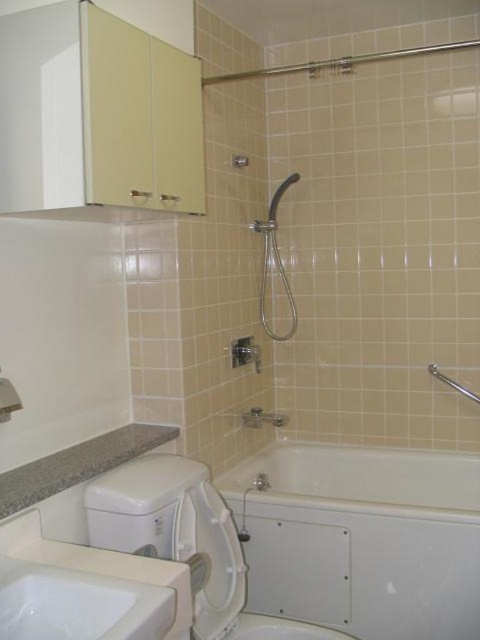
Looking at this image, does white ceramic sink at lower left have a lesser width compared to matte silver faucet at lower center?

Incorrect, white ceramic sink at lower left's width is not less than matte silver faucet at lower center's.

Does white ceramic sink at lower left appear on the right side of matte silver faucet at lower center?

No, white ceramic sink at lower left is not to the right of matte silver faucet at lower center.

Identify the location of white ceramic sink at lower left. (79, 604).

Can you confirm if white glossy bathtub at lower center is thinner than granite countertop at lower left?

No, white glossy bathtub at lower center is not thinner than granite countertop at lower left.

Which is in front, point (300, 516) or point (50, 484)?

Point (50, 484) is in front.

What are the coordinates of `white glossy bathtub at lower center` in the screenshot? It's located at (362, 538).

Does white glossy bathtub at lower center have a smaller size compared to white ceramic sink at lower left?

No.

Does white glossy bathtub at lower center have a lesser width compared to white ceramic sink at lower left?

In fact, white glossy bathtub at lower center might be wider than white ceramic sink at lower left.

Is point (455, 625) in front of point (144, 609)?

No, (455, 625) is further to viewer.

Image resolution: width=480 pixels, height=640 pixels. I want to click on white glossy bathtub at lower center, so click(362, 538).